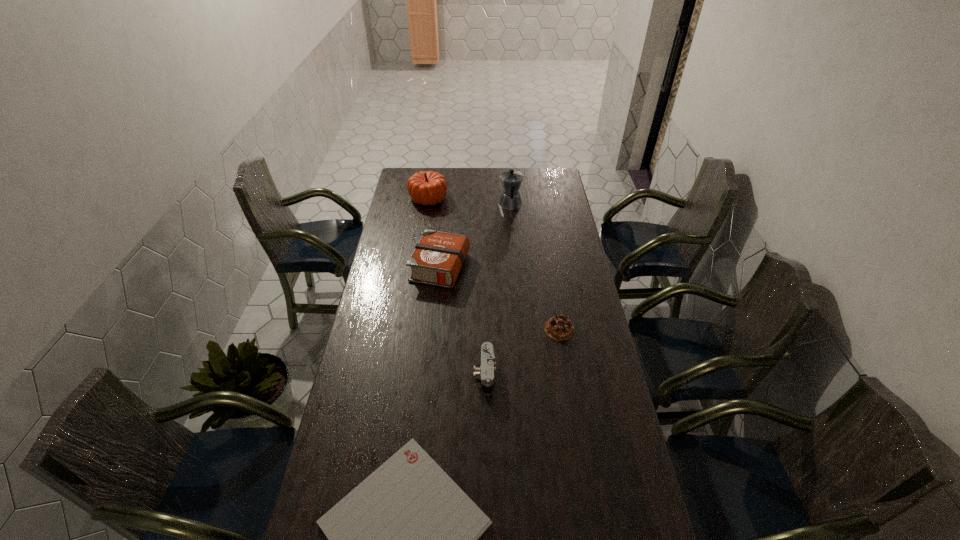
The width and height of the screenshot is (960, 540). I want to click on Bible present at the left edge, so tap(437, 259).

What are the coordinates of `object that is at the right edge` in the screenshot? It's located at (560, 328).

You are a GUI agent. You are given a task and a screenshot of the screen. Output one action in this format:
    pyautogui.click(x=<x>, y=<y>)
    Task: Click on the object situated at the far left corner
    
    Given the screenshot: What is the action you would take?
    pyautogui.click(x=426, y=187)

Where is `vacant space at the far edge of the desktop`? vacant space at the far edge of the desktop is located at coordinates (458, 167).

The image size is (960, 540). Find the location of `vacant space at the left edge`. vacant space at the left edge is located at coordinates (359, 357).

Locate an element on the screen. vacant space at the right edge of the desktop is located at coordinates (555, 255).

This screenshot has width=960, height=540. I want to click on empty space that is in between the second tallest object and the camera, so click(456, 286).

You are a GUI agent. You are given a task and a screenshot of the screen. Output one action in this format:
    pyautogui.click(x=<x>, y=<y>)
    Task: Click on the free space between the coffeepot and the fifth farthest object
    
    Given the screenshot: What is the action you would take?
    pyautogui.click(x=497, y=289)

Find the location of a particular element. This screenshot has width=960, height=540. free space between the chocolate cake and the Bible is located at coordinates (499, 298).

This screenshot has width=960, height=540. Find the location of `empty space that is in between the chocolate cake and the fourth shortest object`. empty space that is in between the chocolate cake and the fourth shortest object is located at coordinates (499, 298).